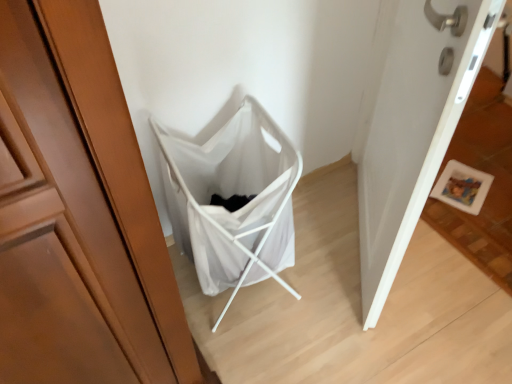
Where is `free space underneath white fabric laundry basket at center (from a real-world perspective)`? The image size is (512, 384). free space underneath white fabric laundry basket at center (from a real-world perspective) is located at coordinates (246, 301).